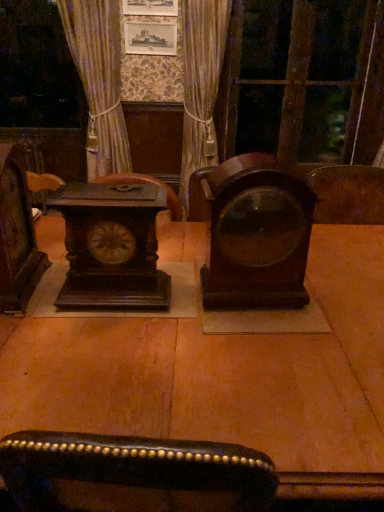
You are a GUI agent. You are given a task and a screenshot of the screen. Output one action in this format:
    pyautogui.click(x=<x>, y=<y>)
    Task: Click on the empty space that is to the right of dark wood clock at left
    
    Given the screenshot: What is the action you would take?
    pyautogui.click(x=61, y=303)